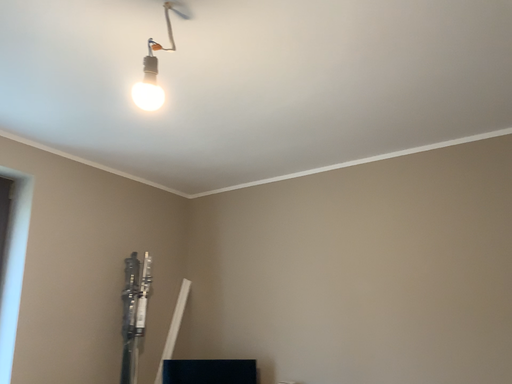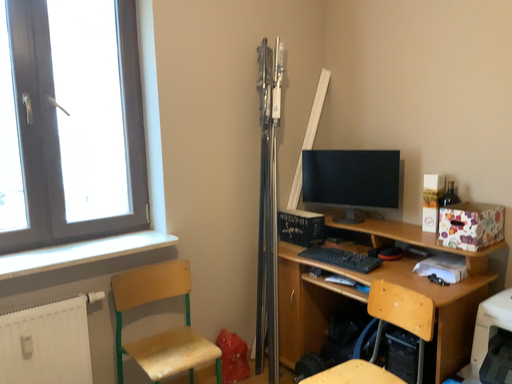
Question: How did the camera likely rotate when shooting the video?

Choices:
 (A) rotated downward
 (B) rotated upward

Answer: (A)